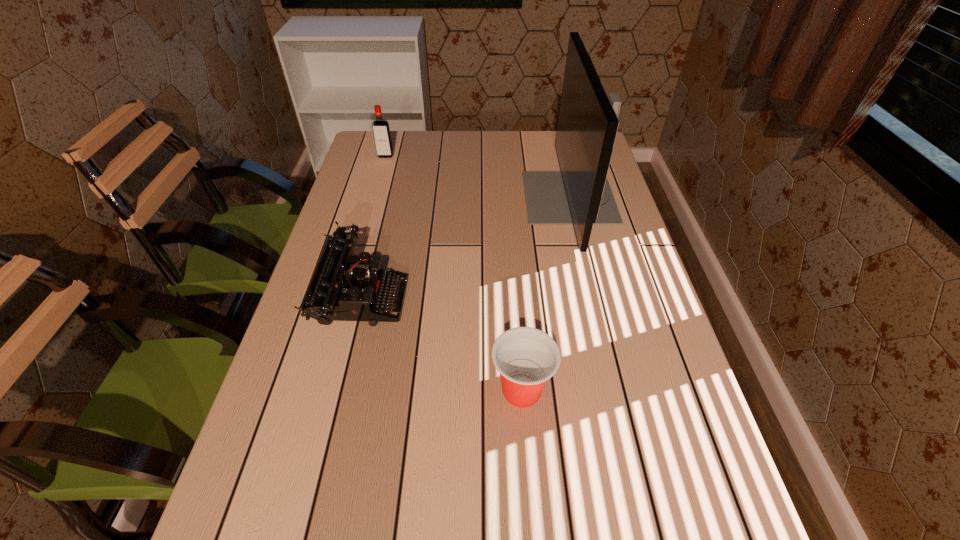
Find the location of a particular element. computer monitor that is at the far edge is located at coordinates (580, 195).

The height and width of the screenshot is (540, 960). I want to click on vodka located in the far edge section of the desktop, so click(x=382, y=137).

Identify the location of vodka present at the left edge. (382, 137).

This screenshot has height=540, width=960. What are the coordinates of `typewriter that is positioned at the left edge` in the screenshot? It's located at (340, 290).

I want to click on object situated at the right edge, so click(580, 195).

This screenshot has width=960, height=540. I want to click on object that is at the far left corner, so click(382, 137).

Image resolution: width=960 pixels, height=540 pixels. I want to click on object at the far right corner, so click(580, 195).

You are a GUI agent. You are given a task and a screenshot of the screen. Output one action in this format:
    pyautogui.click(x=<x>, y=<y>)
    Task: Click on the free spot at the far edge of the desktop
    Image resolution: width=960 pixels, height=540 pixels.
    Given the screenshot: What is the action you would take?
    pyautogui.click(x=467, y=138)

At what (x,y) coordinates should I click in order to perform the action: click on free space at the left edge of the desktop. Please return your answer as a coordinate pair (x, y). The width and height of the screenshot is (960, 540). Looking at the image, I should click on (231, 539).

In the image, there is a desktop. Where is `free space at the right edge`? This screenshot has height=540, width=960. free space at the right edge is located at coordinates (595, 295).